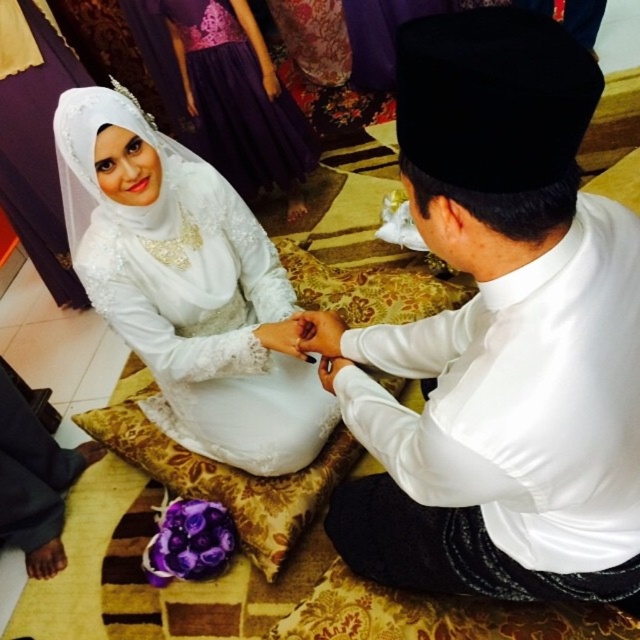
Question: Which point is closer to the camera?

Choices:
 (A) white satin shirt at center
 (B) white lace dress at upper left

Answer: (A)

Question: Among these objects, which one is nearest to the camera?

Choices:
 (A) white lace dress at upper left
 (B) white satin hand at center
 (C) white lace veil at upper left
 (D) white satin shirt at center

Answer: (D)

Question: Which is nearer to the white lace dress at upper left?

Choices:
 (A) white lace veil at upper left
 (B) white satin shirt at center

Answer: (B)

Question: Is white satin shirt at center to the left of white lace dress at upper left from the viewer's perspective?

Choices:
 (A) no
 (B) yes

Answer: (A)

Question: Does white lace dress at upper left have a greater width compared to white satin hand at center?

Choices:
 (A) no
 (B) yes

Answer: (B)

Question: Is white lace dress at upper left positioned before white lace veil at upper left?

Choices:
 (A) yes
 (B) no

Answer: (A)